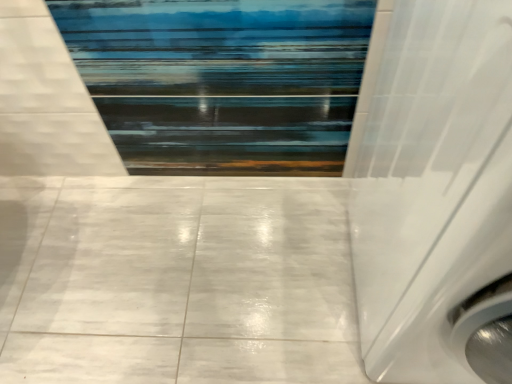
Find the location of a particular element. This screenshot has width=512, height=384. white glossy shower curtain at right is located at coordinates (437, 198).

The height and width of the screenshot is (384, 512). Describe the element at coordinates (437, 198) in the screenshot. I see `white glossy shower curtain at right` at that location.

Where is `white glossy shower curtain at right`? This screenshot has width=512, height=384. white glossy shower curtain at right is located at coordinates (437, 198).